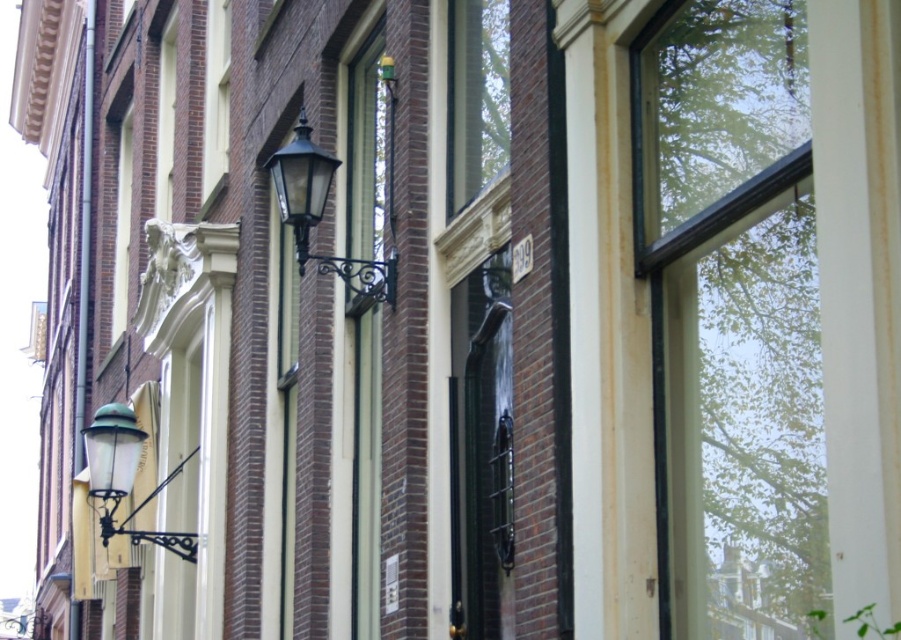
Based on the photo, you are an architect designing a new facade for a building. You have two decorative elements to place on the wall between two windows. The matte black lantern at upper center and the green glass lamp at upper left. Given their sizes, which one would you choose if you need to fit a narrower object in the space?

The matte black lantern at upper center has a smaller width than the green glass lamp at upper left, so it would be the better choice for fitting into a narrower space.

You are standing in front of the traditional European building and want to hang a new decoration exactly at the same height as the matte black lantern at upper center. What coordinate should you use for the y value?

The y coordinate for the matte black lantern at upper center is 0.357, so you should set the y value to 0.357 to hang the decoration at the same height.

You are standing in front of a historic building and notice two lighting fixtures. The first is a matte black lantern at upper center, and the second is a green glass lamp at upper left. Which of these fixtures is positioned closer to your viewpoint?

The matte black lantern at upper center is closer to the viewer than the green glass lamp at upper left.